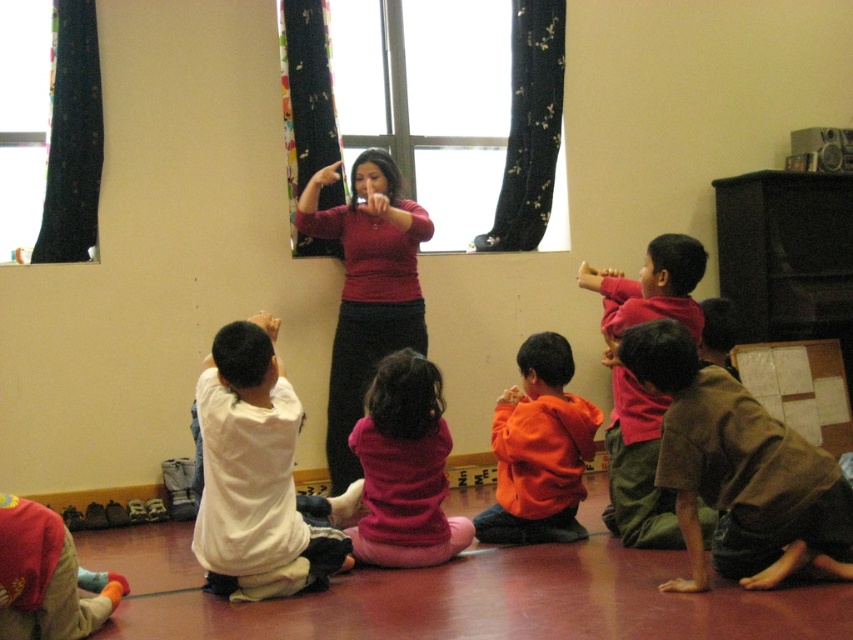
You are a photographer standing in the classroom. You want to take a closeup photo of the orange fleece sweater at center. The camera you are using has a minimum focusing distance of 10 feet. Can you take the photo without moving closer?

The orange fleece sweater at center is 11.29 feet away from the camera. Since the minimum focusing distance is 10 feet, the camera can focus on the orange fleece sweater at center as it is beyond the minimum distance required.

You are a teacher in the classroom and want to hand out a worksheet to the child wearing the orange fleece sweater at center and the child in white soft pants at lower left. Which child should you approach first to ensure you can reach them without moving too far from your current position?

You should approach the orange fleece sweater at center first because it is closer to you than the white soft pants at lower left, so you can reach them without moving as much.

Looking at this image, you are a teacher in the classroom. You need to hand out a small toy to each child wearing a fleece sweater. The toy requires you to place it between two children. The two fleece sweaters at center are the only ones available. Can you place the toy between the pink fleece sweater at center and the orange fleece sweater at center?

The distance between the pink fleece sweater at center and the orange fleece sweater at center is 38.43 inches, so yes, you can place the toy between them as there is sufficient space.